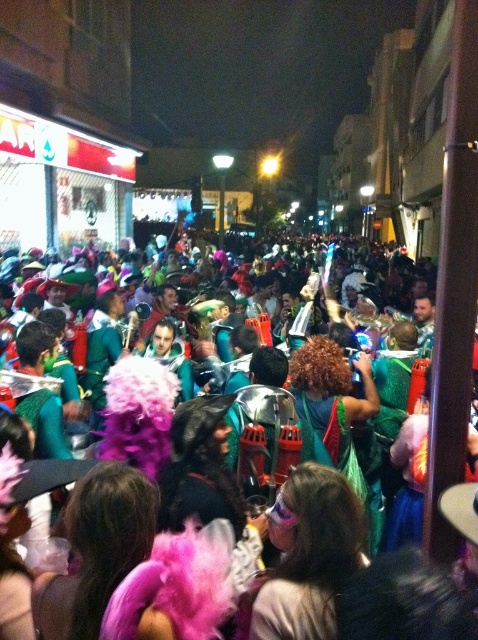
You are a photographer at the event and want to capture both the fuzzy pink boa at center and the shiny pink wig at center in a single frame. Since your camera has a fixed focus, which object should you focus on to ensure it appears clearer in the photo?

The fuzzy pink boa at center is larger in size than the shiny pink wig at center, so focusing on the fuzzy pink boa at center would ensure it appears clearer in the photo.

You are a photographer trying to capture a clear shot of both the fuzzy pink boa at center and the shiny pink wig at center in the lively night scene. Since you want both items to be visible in your photo, which one should you focus on first to ensure it doesn t get cut off by the edge of the frame?

The fuzzy pink boa at center is taller than the shiny pink wig at center, so you should focus on the fuzzy pink boa at center first to ensure it doesn t get cut off by the edge of the frame.